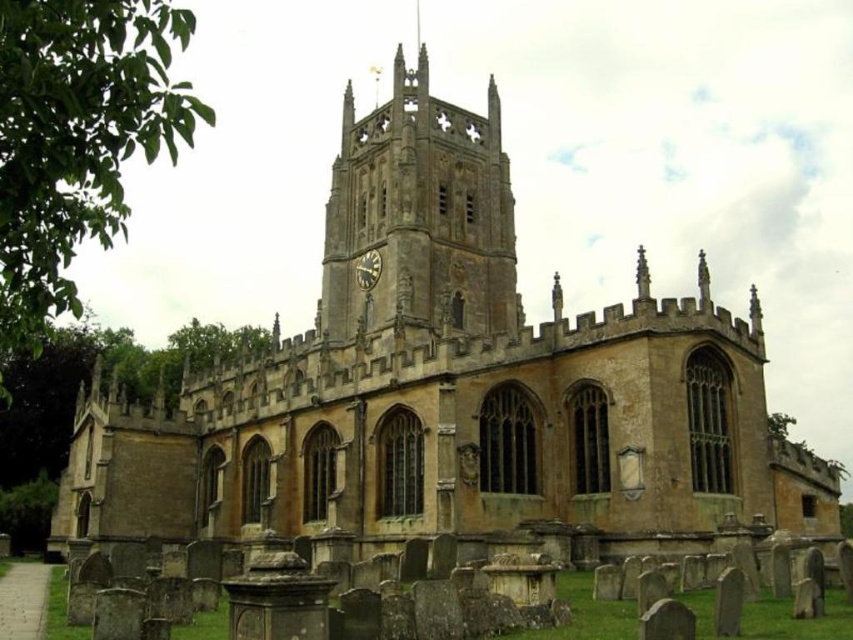
Question: Is golden stone tower at center below matte gold clock at center?

Choices:
 (A) yes
 (B) no

Answer: (B)

Question: Which point is farther from the camera taking this photo?

Choices:
 (A) (505, 285)
 (B) (361, 282)

Answer: (A)

Question: Among these objects, which one is farthest from the camera?

Choices:
 (A) golden stone tower at center
 (B) matte gold clock at center

Answer: (B)

Question: Does golden stone tower at center have a greater width compared to matte gold clock at center?

Choices:
 (A) no
 (B) yes

Answer: (B)

Question: Considering the relative positions of golden stone tower at center and matte gold clock at center in the image provided, where is golden stone tower at center located with respect to matte gold clock at center?

Choices:
 (A) right
 (B) left

Answer: (A)

Question: Which point is farther to the camera?

Choices:
 (A) matte gold clock at center
 (B) golden stone tower at center

Answer: (A)